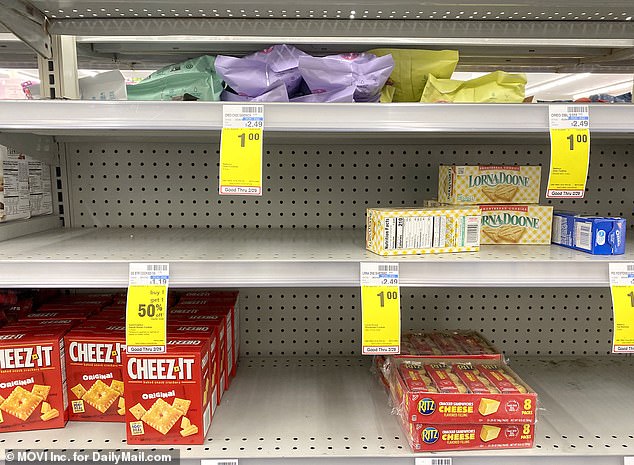
Find the location of `shelf tags`. shelf tags is located at coordinates (146, 307), (384, 315), (628, 324), (560, 177), (240, 158).